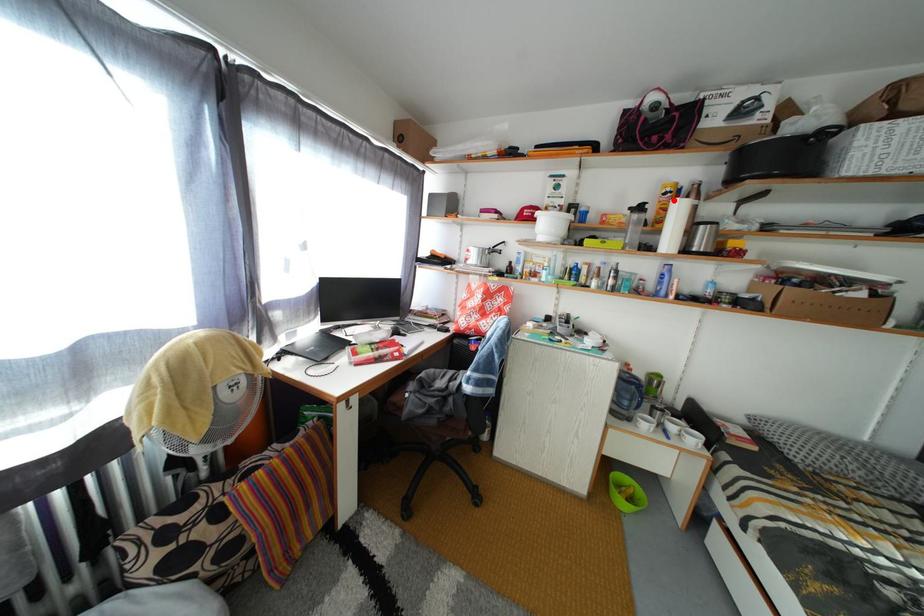
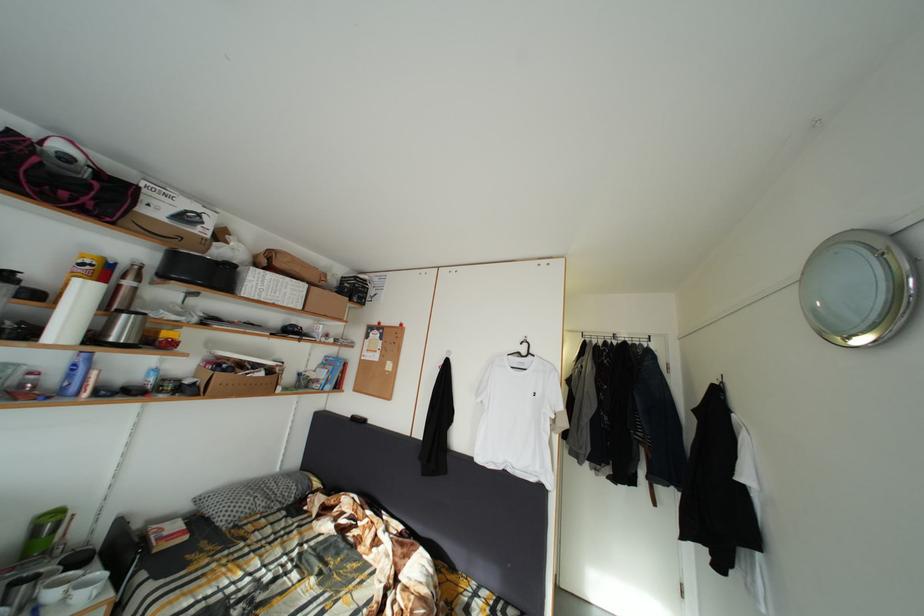
The point at the highlighted location is marked in the first image. Where is the corresponding point in the second image?

(91, 270)